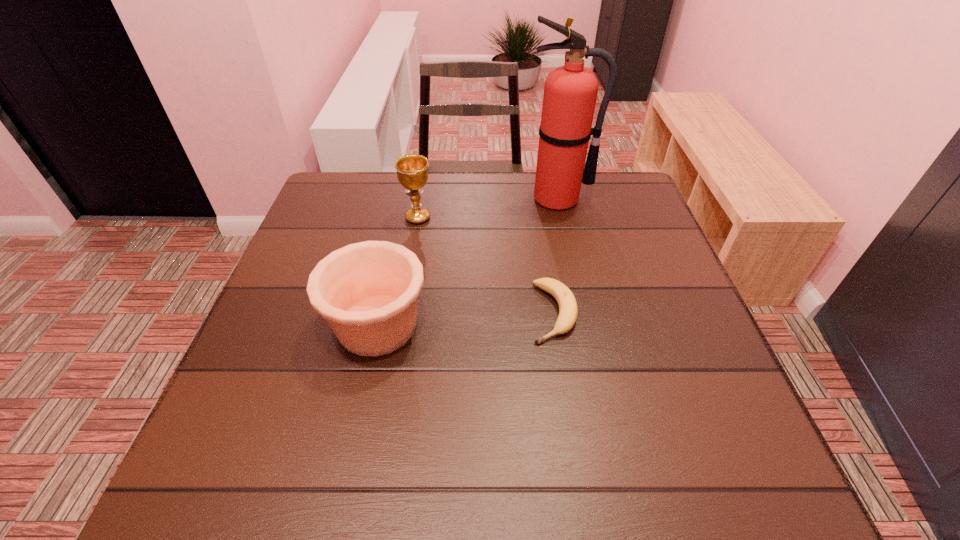
The width and height of the screenshot is (960, 540). Find the location of `vacant region that satisfies the following two spatial constraints: 1. on the back side of the chalice; 2. on the right side of the second shortest object`. vacant region that satisfies the following two spatial constraints: 1. on the back side of the chalice; 2. on the right side of the second shortest object is located at coordinates (400, 218).